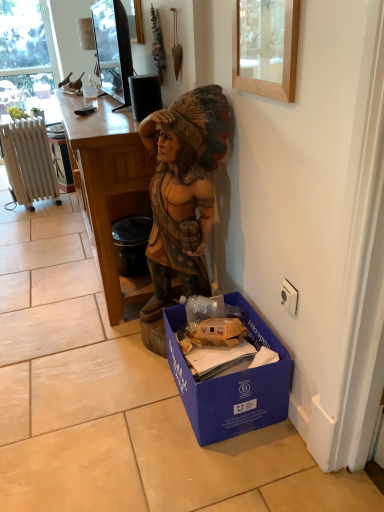
You are a GUI agent. You are given a task and a screenshot of the screen. Output one action in this format:
    pyautogui.click(x=<x>, y=<y>)
    Task: Click on the free space in front of blue cardboard box at lower right
    The image size is (384, 512).
    Given the screenshot: What is the action you would take?
    pyautogui.click(x=232, y=468)